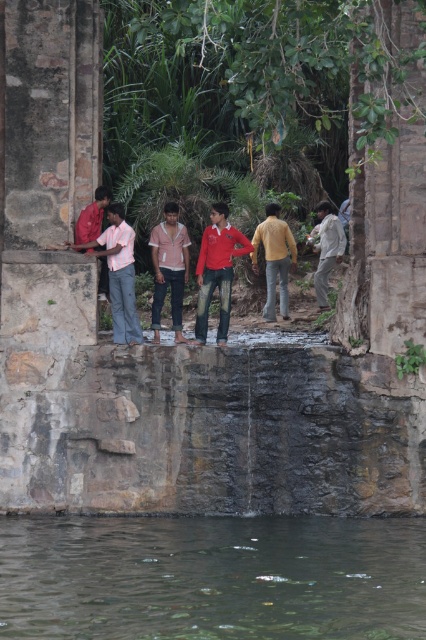
Does pink cotton shirt at center have a smaller size compared to matte yellow shirt at center?

Indeed, pink cotton shirt at center has a smaller size compared to matte yellow shirt at center.

Which is below, pink cotton shirt at center or matte yellow shirt at center?

pink cotton shirt at center is lower down.

Between point (178, 227) and point (285, 300), which one is positioned in front?

Point (178, 227)

Locate an element on the screen. Image resolution: width=426 pixels, height=640 pixels. pink cotton shirt at center is located at coordinates (169, 268).

Is striped cotton shirt at left behind matte yellow shirt at center?

No.

Where is `striped cotton shirt at left`? This screenshot has width=426, height=640. striped cotton shirt at left is located at coordinates (118, 273).

Consider the image. Which is below, matte red shirt at center or striped cotton shirt at left?

matte red shirt at center is below.

Can you confirm if matte red shirt at center is smaller than striped cotton shirt at left?

Actually, matte red shirt at center might be larger than striped cotton shirt at left.

Who is more distant from viewer, (226, 237) or (126, 339)?

The point (226, 237) is behind.

Where is `matte red shirt at center`? The width and height of the screenshot is (426, 640). matte red shirt at center is located at coordinates (216, 269).